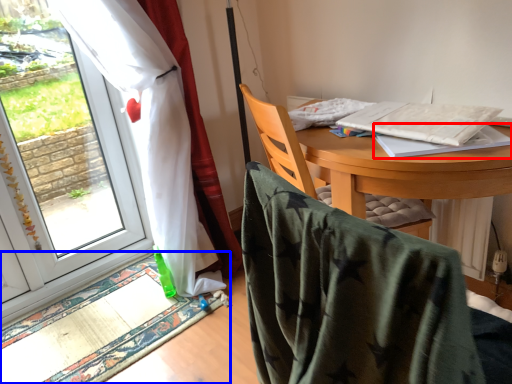
Question: Among these objects, which one is farthest to the camera, notebook (highlighted by a red box) or mat (highlighted by a blue box)?

Choices:
 (A) notebook
 (B) mat

Answer: (B)